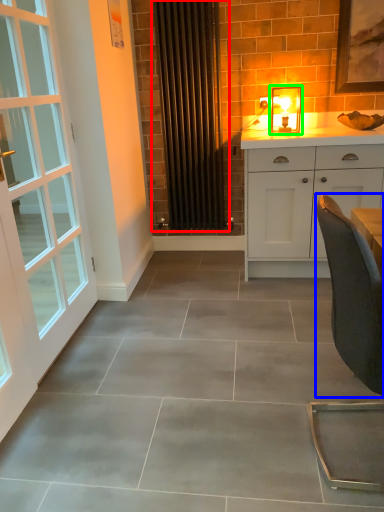
Question: Which object is positioned farthest from radiator (highlighted by a red box)? Select from chair (highlighted by a blue box) and light fixture (highlighted by a green box).

Choices:
 (A) chair
 (B) light fixture

Answer: (A)